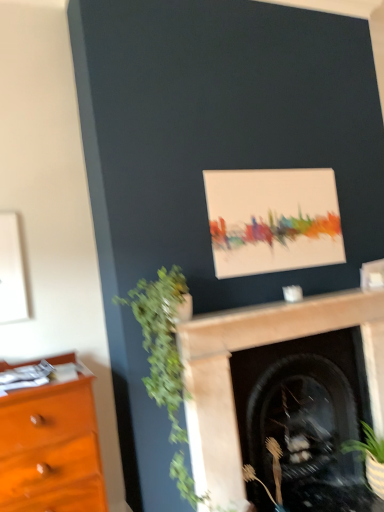
Identify the location of free spot below matte canvas painting at upper center (from a real-world perspective). The image size is (384, 512). (292, 300).